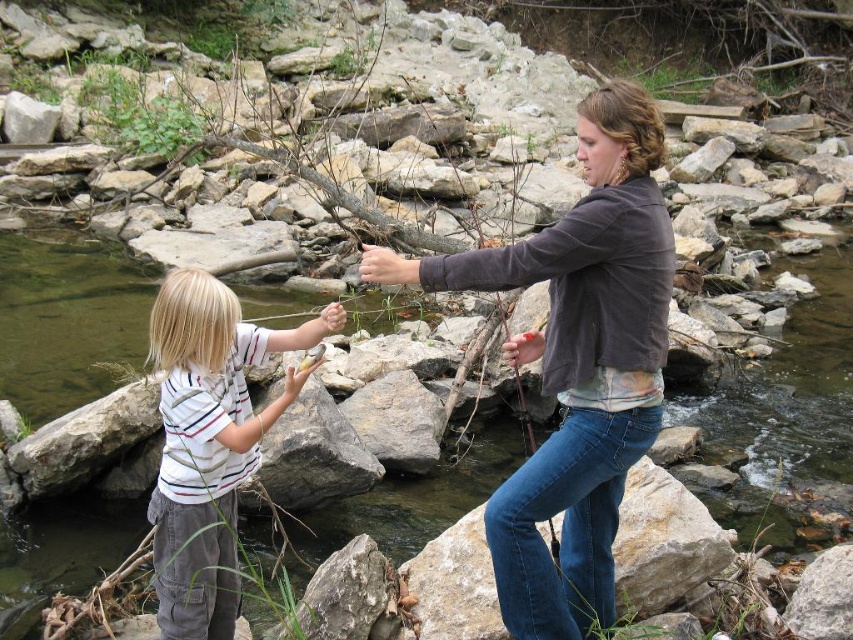
Question: Which of the following is the farthest from the observer?

Choices:
 (A) white striped shirt at center
 (B) matte brown jacket at center

Answer: (A)

Question: Is matte brown jacket at center positioned at the back of white striped shirt at center?

Choices:
 (A) no
 (B) yes

Answer: (A)

Question: Does matte brown jacket at center appear under white striped shirt at center?

Choices:
 (A) no
 (B) yes

Answer: (A)

Question: From the image, what is the correct spatial relationship of matte brown jacket at center in relation to white striped shirt at center?

Choices:
 (A) below
 (B) above

Answer: (B)

Question: Among these points, which one is nearest to the camera?

Choices:
 (A) (573, 332)
 (B) (218, 353)

Answer: (A)